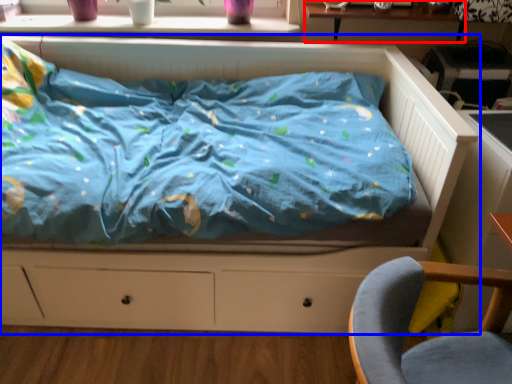
Question: Which object is closer to the camera taking this photo, table (highlighted by a red box) or bed (highlighted by a blue box)?

Choices:
 (A) table
 (B) bed

Answer: (B)